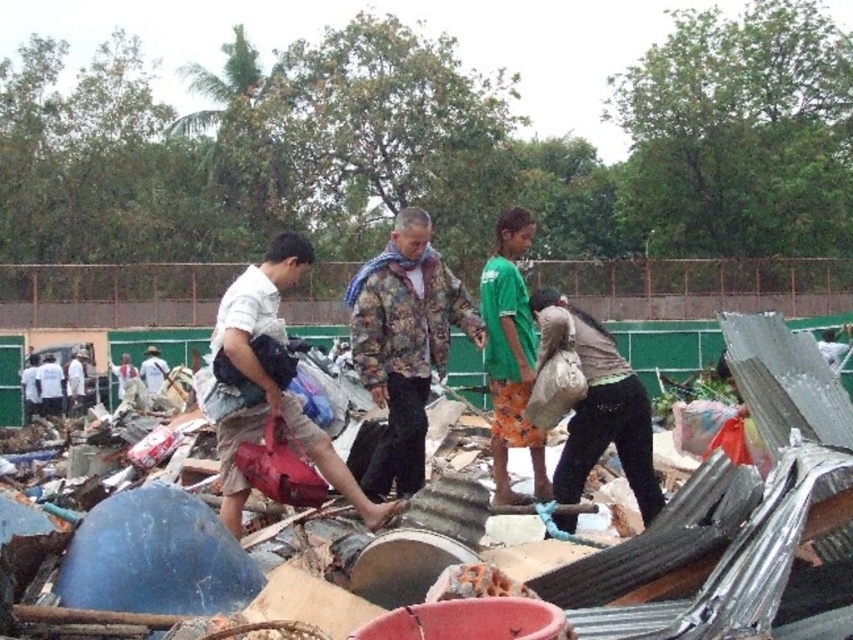
Does rusty metal debris at center appear over floral-patterned jacket at center?

Correct, rusty metal debris at center is located above floral-patterned jacket at center.

Which is behind, point (311, 310) or point (407, 378)?

Positioned behind is point (311, 310).

Is point (567, 284) farther from camera compared to point (426, 212)?

That is True.

Where is `rusty metal debris at center`? rusty metal debris at center is located at coordinates (695, 301).

Is rusty metal debris at center to the left of light brown fabric shirt at left from the viewer's perspective?

No, rusty metal debris at center is not to the left of light brown fabric shirt at left.

Between rusty metal debris at center and light brown fabric shirt at left, which one is positioned lower?

rusty metal debris at center is below.

Which is in front, point (590, 282) or point (242, 326)?

Point (242, 326)

The image size is (853, 640). In order to click on rusty metal debris at center in this screenshot , I will do `click(695, 301)`.

Between floral-patterned jacket at center and brown fabric bag at center, which one appears on the left side from the viewer's perspective?

Positioned to the left is floral-patterned jacket at center.

Is floral-patterned jacket at center to the left of brown fabric bag at center from the viewer's perspective?

Indeed, floral-patterned jacket at center is positioned on the left side of brown fabric bag at center.

Does point (402, 417) come in front of point (646, 397)?

No, it is behind (646, 397).

Image resolution: width=853 pixels, height=640 pixels. I want to click on floral-patterned jacket at center, so click(404, 342).